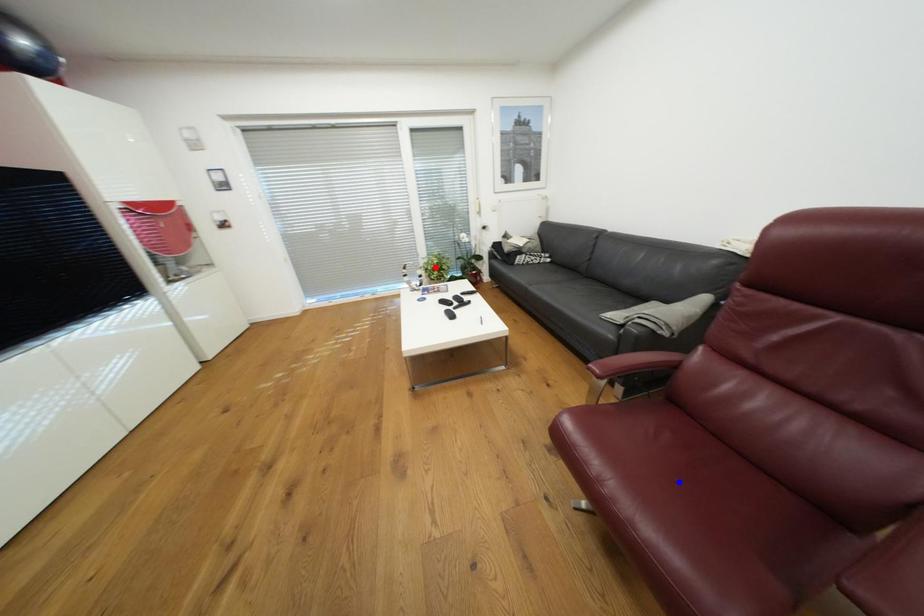
Question: In the image, two points are highlighted. Which point is nearer to the camera? Reply with the corresponding letter.

Choices:
 (A) blue point
 (B) red point

Answer: (A)